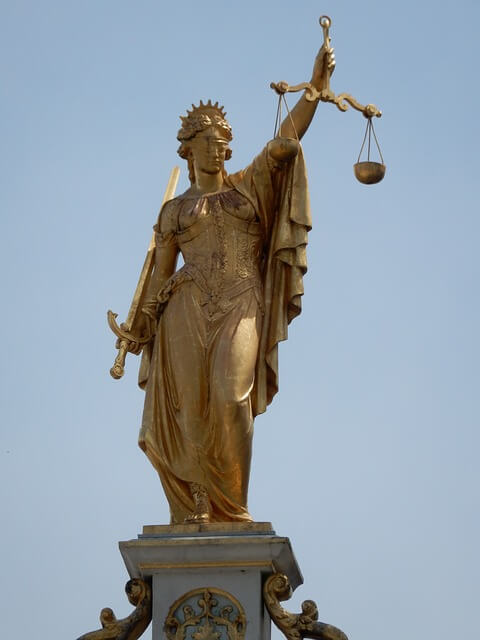
This screenshot has height=640, width=480. In order to click on marble base in this screenshot , I will do `click(235, 548)`.